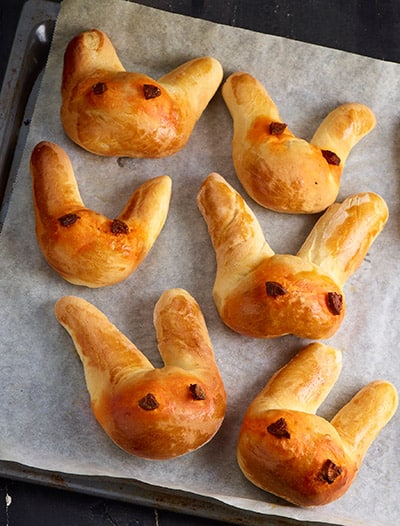
The image size is (400, 526). Find the location of `table`. table is located at coordinates (69, 520).